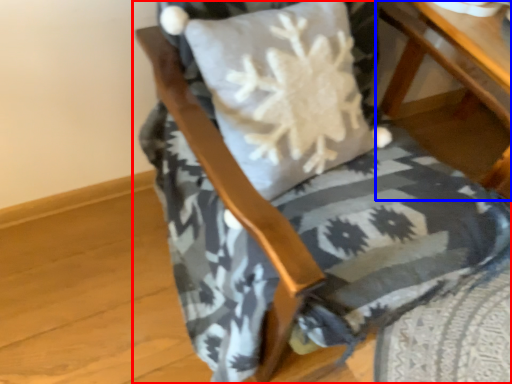
Question: Which of the following is the closest to the observer, chair (highlighted by a red box) or table (highlighted by a blue box)?

Choices:
 (A) chair
 (B) table

Answer: (A)